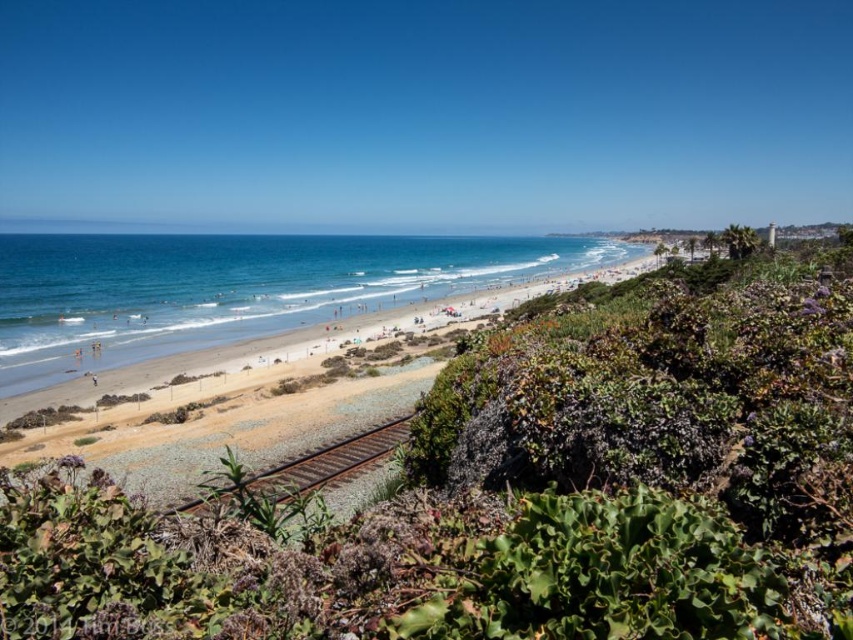
Is brown sand beach at center smaller than brown gravel train track at center?

Actually, brown sand beach at center might be larger than brown gravel train track at center.

Which is below, brown sand beach at center or brown gravel train track at center?

Positioned lower is brown gravel train track at center.

This screenshot has width=853, height=640. What are the coordinates of `brown sand beach at center` in the screenshot? It's located at (271, 396).